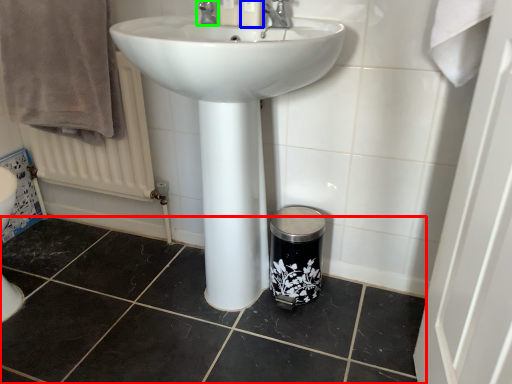
Question: Based on their relative distances, which object is farther from tile (highlighted by a red box)? Choose from toiletry (highlighted by a blue box) and tap (highlighted by a green box).

Choices:
 (A) toiletry
 (B) tap

Answer: (A)